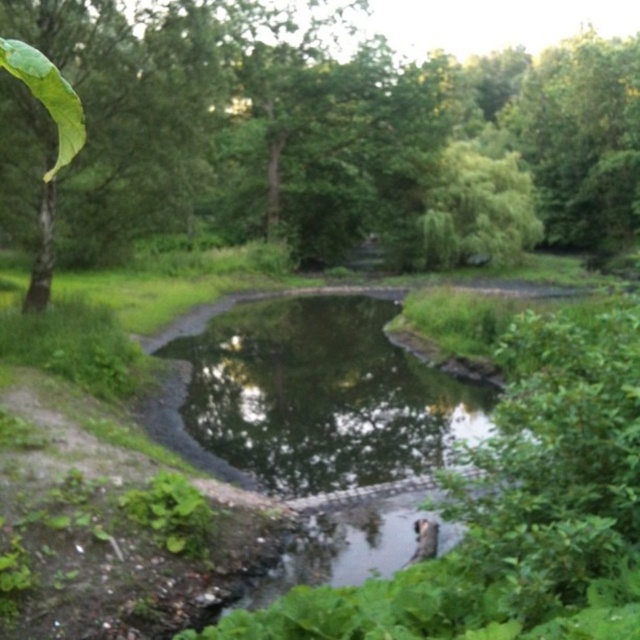
Locate an element on the screen. green leafy tree at upper left is located at coordinates (250, 131).

Does point (19, 208) come in front of point (368, 310)?

Yes, point (19, 208) is closer to viewer.

Who is more forward, [164,10] or [163,392]?

Point [163,392] is more forward.

I want to click on green leafy tree at upper left, so pyautogui.click(x=250, y=131).